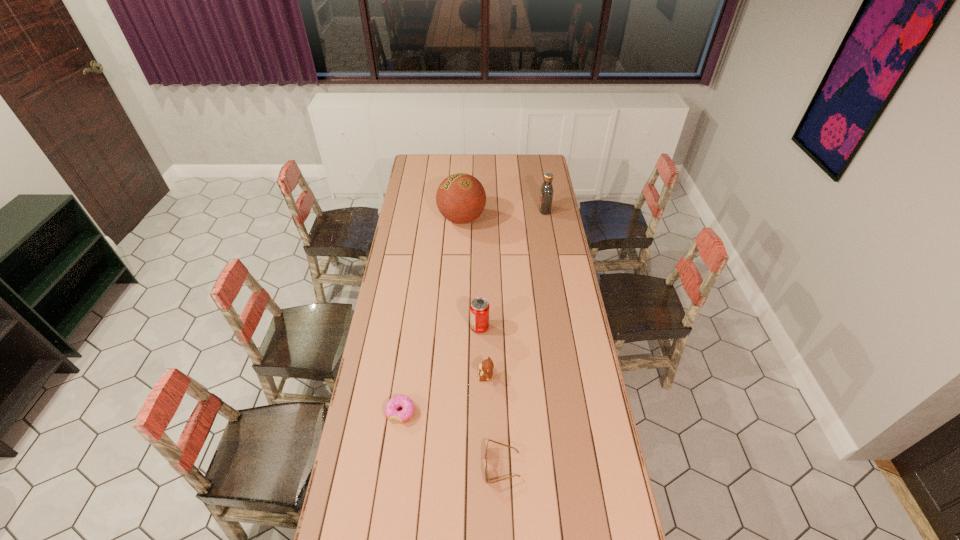
The height and width of the screenshot is (540, 960). Find the location of `vacant space located 0.110m on the frames of the nearest object`. vacant space located 0.110m on the frames of the nearest object is located at coordinates (451, 465).

Locate an element on the screen. This screenshot has width=960, height=540. vacant space located on the frames of the nearest object is located at coordinates (443, 465).

Where is `object that is at the left edge`? The width and height of the screenshot is (960, 540). object that is at the left edge is located at coordinates coord(399,401).

At what (x,y) coordinates should I click in order to perform the action: click on object at the right edge. Please return your answer as a coordinate pair (x, y). The width and height of the screenshot is (960, 540). Looking at the image, I should click on (546, 193).

The height and width of the screenshot is (540, 960). What are the coordinates of `vacant space at the far edge` in the screenshot? It's located at (500, 157).

Where is `free region at the left edge`? free region at the left edge is located at coordinates (380, 480).

I want to click on free space at the right edge, so click(562, 298).

Image resolution: width=960 pixels, height=540 pixels. In the image, there is a desktop. Find the location of `vacant space at the far right corner`. vacant space at the far right corner is located at coordinates (540, 161).

The height and width of the screenshot is (540, 960). Find the location of `vacant area between the soda can and the second tallest object`. vacant area between the soda can and the second tallest object is located at coordinates (513, 269).

Where is `empty space that is in between the basketball and the second tallest object`? The image size is (960, 540). empty space that is in between the basketball and the second tallest object is located at coordinates (503, 214).